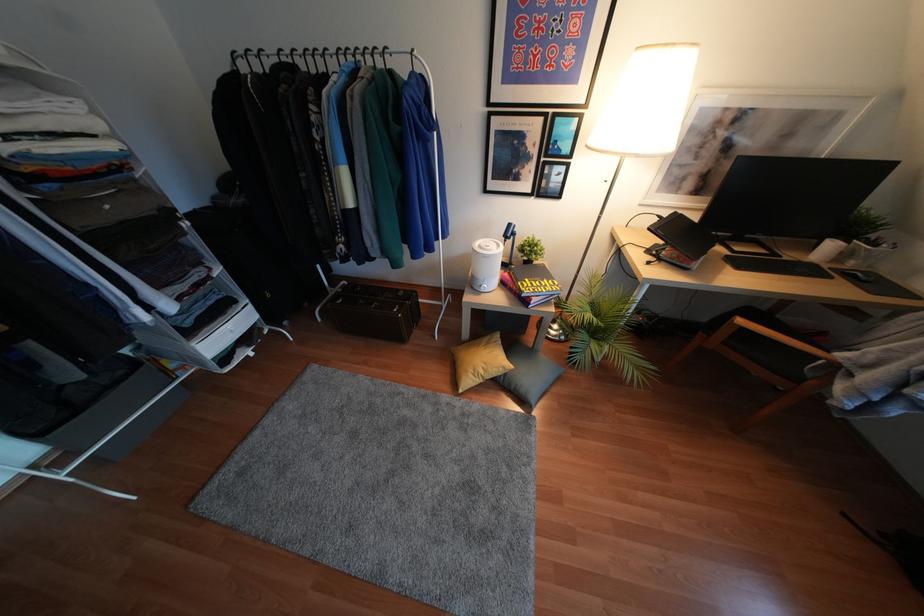
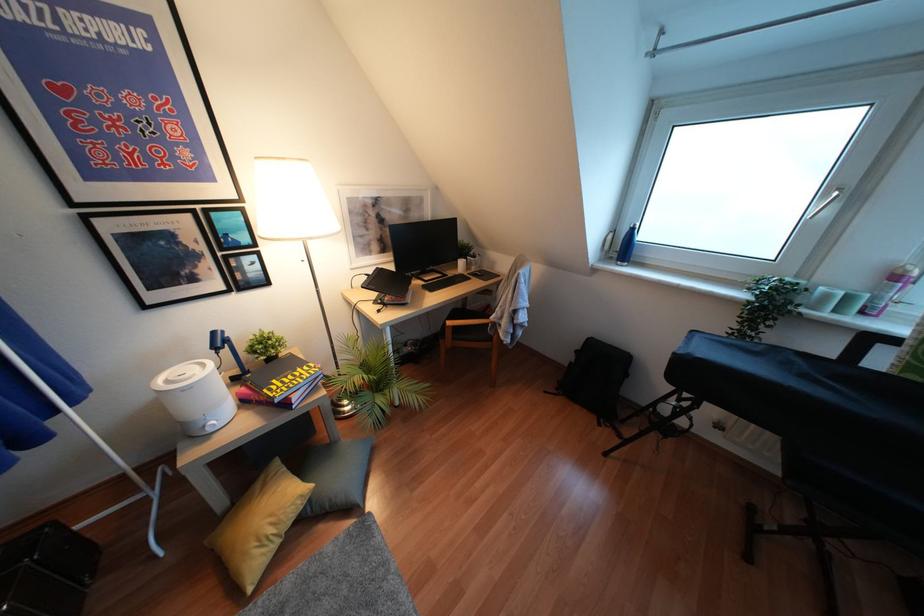
Question: Based on the continuous images, in which direction is the camera rotating? Reply with the corresponding letter.

Choices:
 (A) Left
 (B) Right
 (C) Up
 (D) Down

Answer: (B)